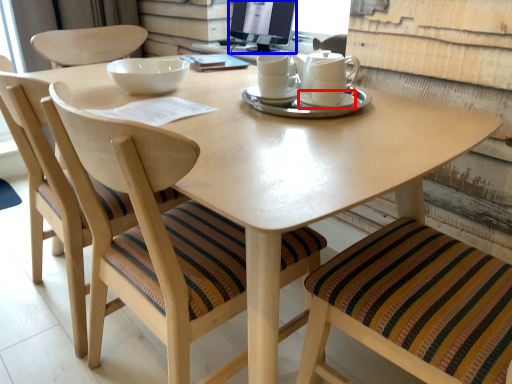
Question: Which object is closer to the camera taking this photo, saucer (highlighted by a red box) or computer monitor (highlighted by a blue box)?

Choices:
 (A) saucer
 (B) computer monitor

Answer: (A)